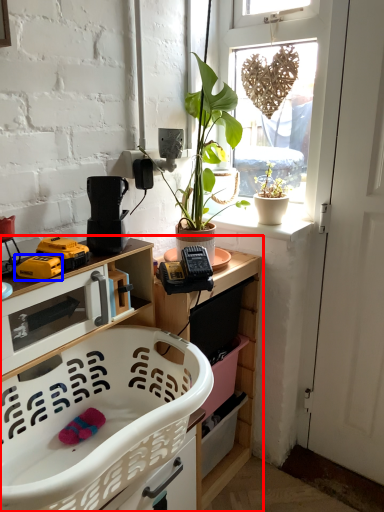
Question: Which object appears farthest to the camera in this image, cabinetry (highlighted by a red box) or toy (highlighted by a blue box)?

Choices:
 (A) cabinetry
 (B) toy

Answer: (B)